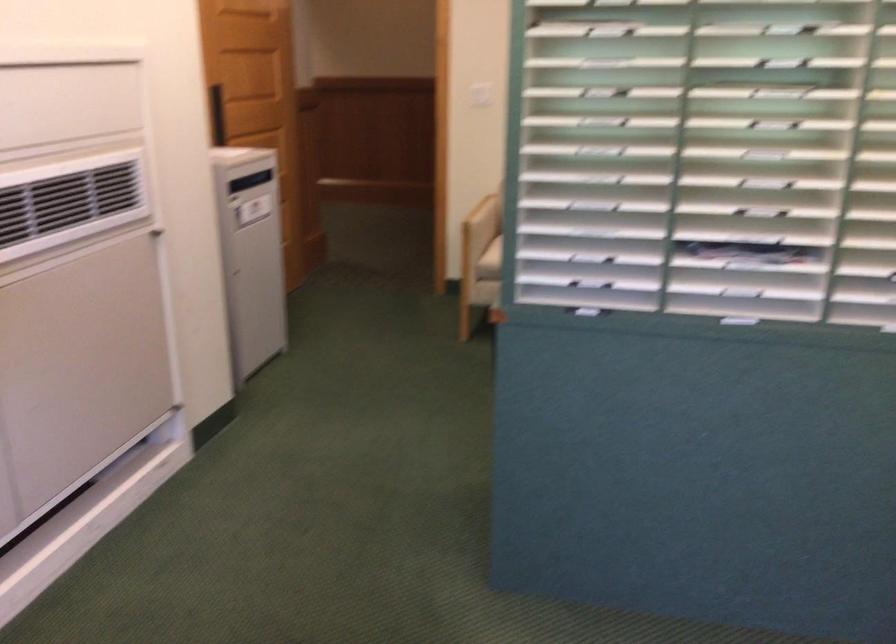
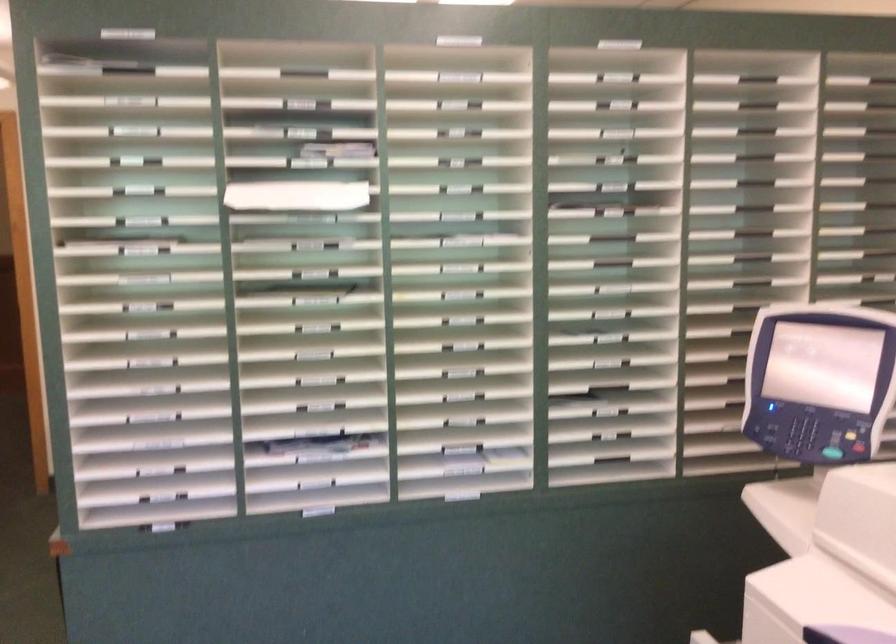
Question: What movement of the cameraman would produce the second image?

Choices:
 (A) Left
 (B) Right
 (C) Forward
 (D) Backward

Answer: (B)